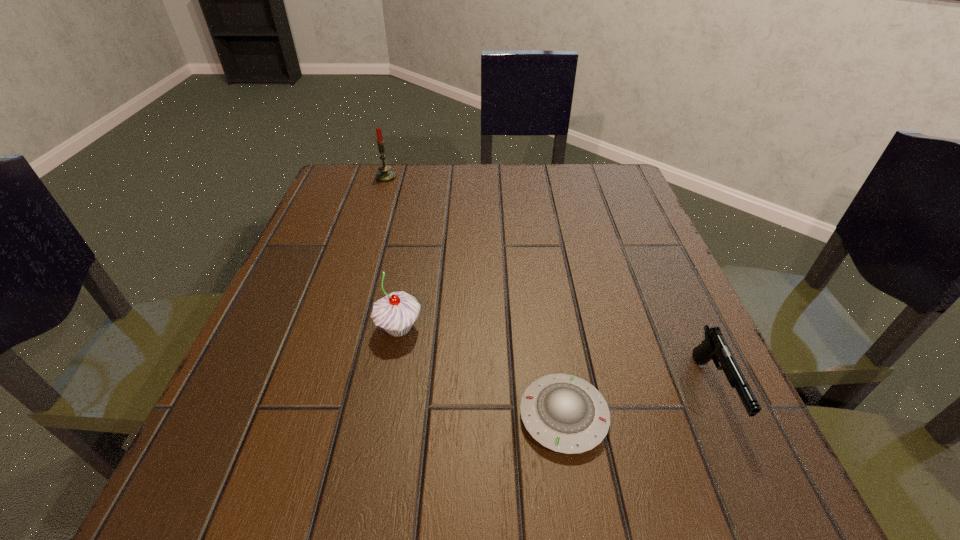
In the image, there is a desktop. At what (x,y) coordinates should I click in order to perform the action: click on vacant region at the right edge. Please return your answer as a coordinate pair (x, y). Looking at the image, I should click on (641, 362).

Identify the location of free space at the far left corner of the desktop. The height and width of the screenshot is (540, 960). (322, 201).

Where is `free space at the far right corner of the desktop`? free space at the far right corner of the desktop is located at coordinates (602, 168).

Locate an element on the screen. The image size is (960, 540). free space between the farthest object and the third object from left to right is located at coordinates (474, 297).

Identify the location of free space between the third object from left to right and the candle. (474, 297).

Image resolution: width=960 pixels, height=540 pixels. What are the coordinates of `free spot between the gun and the farthest object` in the screenshot? It's located at (549, 284).

Identify the location of vacant space in between the second object from right to left and the cupcake. click(481, 373).

At what (x,y) coordinates should I click in order to perform the action: click on vacant space in between the gun and the cupcake. Please return your answer as a coordinate pair (x, y). The height and width of the screenshot is (540, 960). Looking at the image, I should click on pyautogui.click(x=556, y=360).

The width and height of the screenshot is (960, 540). Identify the location of free space between the shortest object and the cupcake. (481, 373).

Where is `free spot between the farthest object and the third object from right to left`? This screenshot has width=960, height=540. free spot between the farthest object and the third object from right to left is located at coordinates [x=393, y=253].